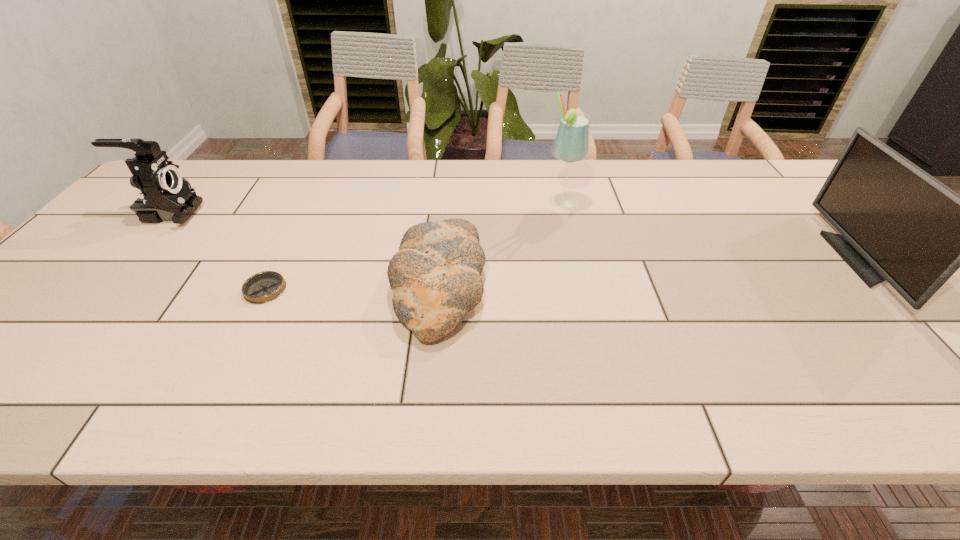
This screenshot has height=540, width=960. I want to click on unoccupied position between the shortest object and the rightmost object, so click(x=562, y=274).

Find the location of a particular element. The image size is (960, 540). free space between the fourth object from left to right and the rightmost object is located at coordinates (710, 230).

Locate an element on the screen. The width and height of the screenshot is (960, 540). free space between the camcorder and the tallest object is located at coordinates (366, 207).

Find the location of a particular element. Image resolution: width=960 pixels, height=540 pixels. vacant area that lies between the third tallest object and the compass is located at coordinates (217, 251).

The height and width of the screenshot is (540, 960). In order to click on free spot between the fourth tallest object and the tallest object in this screenshot , I will do `click(500, 244)`.

Identify which object is located as the fourth nearest to the tallest object. Please provide its 2D coordinates. Your answer should be formatted as a tuple, i.e. [(x, y)], where the tuple contains the x and y coordinates of a point satisfying the conditions above.

[(164, 195)]

Where is `the second closest object to the monitor`? This screenshot has height=540, width=960. the second closest object to the monitor is located at coordinates (435, 276).

Locate an element on the screen. The height and width of the screenshot is (540, 960). vacant space that satisfies the following two spatial constraints: 1. on the lens mount of the third shortest object; 2. on the back side of the compass is located at coordinates (100, 289).

The image size is (960, 540). In order to click on vacant space that satisfies the following two spatial constraints: 1. on the back side of the fourth object from left to right; 2. on the right side of the second shortest object in this screenshot , I will do `click(447, 201)`.

Find the location of `vacant region that satisfies the following two spatial constraints: 1. on the back side of the third object from right to left; 2. on the lens mount of the camcorder`. vacant region that satisfies the following two spatial constraints: 1. on the back side of the third object from right to left; 2. on the lens mount of the camcorder is located at coordinates (445, 213).